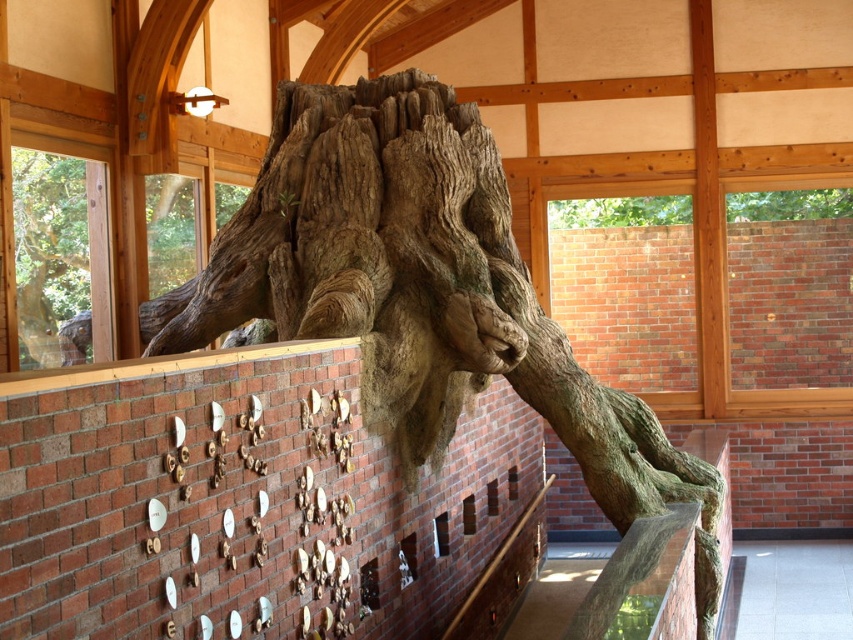
Consider the image. You are an interior designer assessing the placement of the natural wood tree trunk at center and the brown rough bark at upper center. Which object is positioned higher up on the brick wall?

The brown rough bark at upper center is positioned higher up on the brick wall than the natural wood tree trunk at center.

You are standing in the room and want to place a small potted plant exactly where the natural wood tree trunk at center is located. Is this possible?

The natural wood tree trunk at center is already occupying the location at point (421, 292), so you cannot place the potted plant there.

You are an interior designer assessing the space. You need to place a large decorative item that requires a sturdy support. Which object between the brown rough tree trunk at left and the brown rough bark at upper center would be more suitable for this purpose?

The brown rough tree trunk at left is bigger than the brown rough bark at upper center, making it more suitable for supporting a large decorative item due to its larger size and sturdier structure.